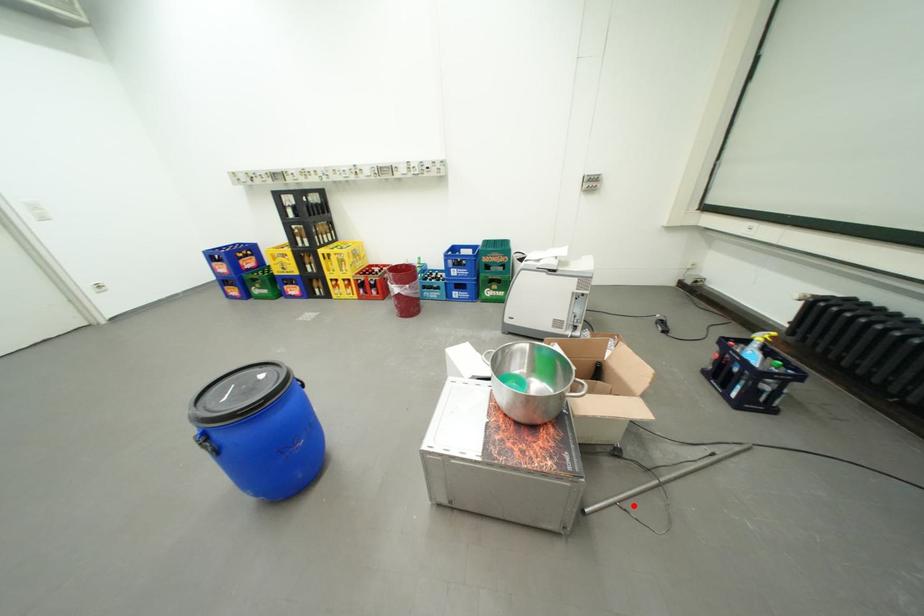
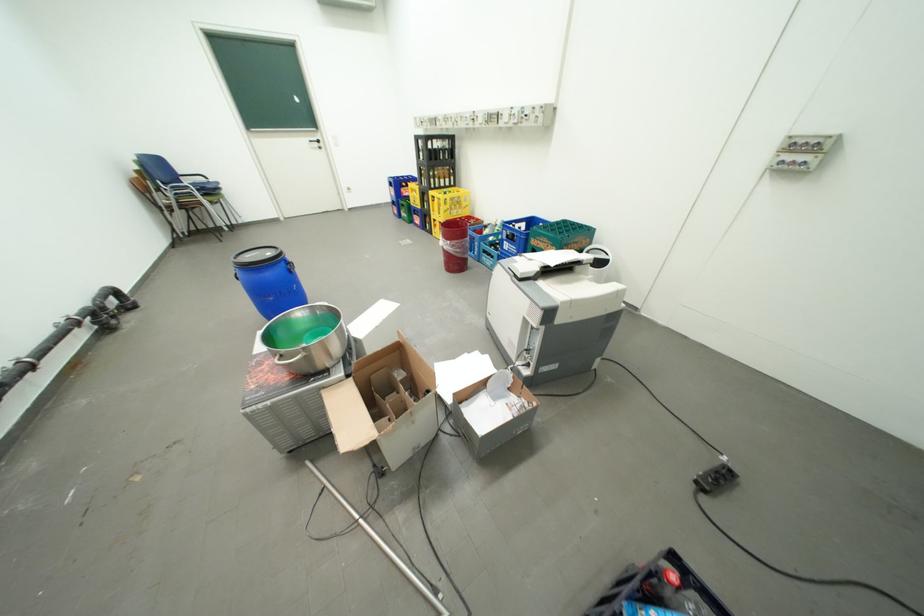
Locate, in the second image, the point that corresponds to the highlighted location in the first image.

(334, 492)